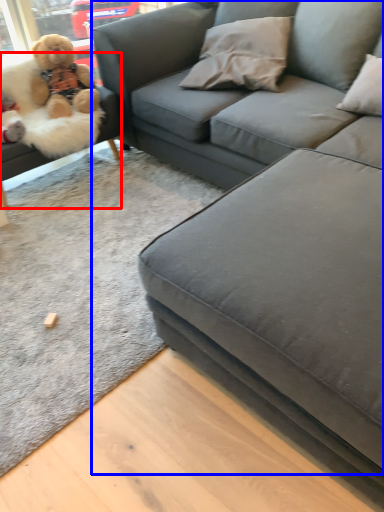
Question: Which object is closer to the camera taking this photo, studio couch (highlighted by a red box) or studio couch (highlighted by a blue box)?

Choices:
 (A) studio couch
 (B) studio couch

Answer: (B)